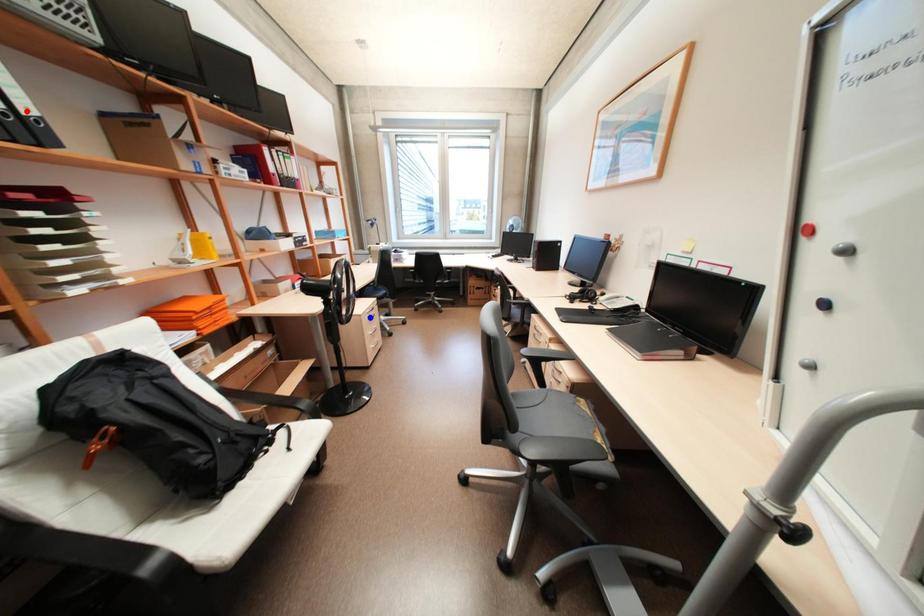
Question: Two points are marked on the image. Which point is closer to the camera?

Choices:
 (A) Blue point is closer.
 (B) Red point is closer.

Answer: (B)